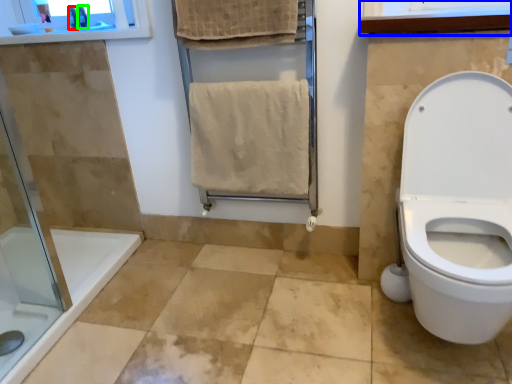
Question: Which object is positioned closest to toiletry (highlighted by a red box)? Select from medicine cabinet (highlighted by a blue box) and toiletry (highlighted by a green box).

Choices:
 (A) medicine cabinet
 (B) toiletry

Answer: (B)